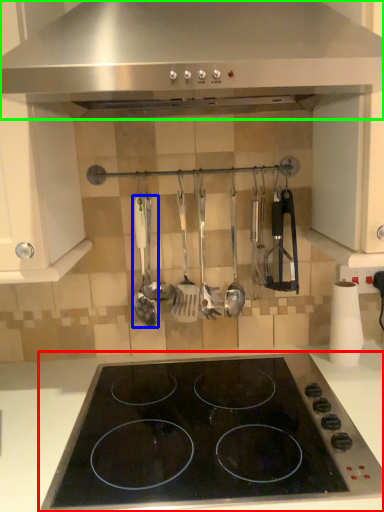
Question: Which is farther away from gas stove (highlighted by a red box)? spatula (highlighted by a blue box) or kitchen appliance (highlighted by a green box)?

Choices:
 (A) spatula
 (B) kitchen appliance

Answer: (B)